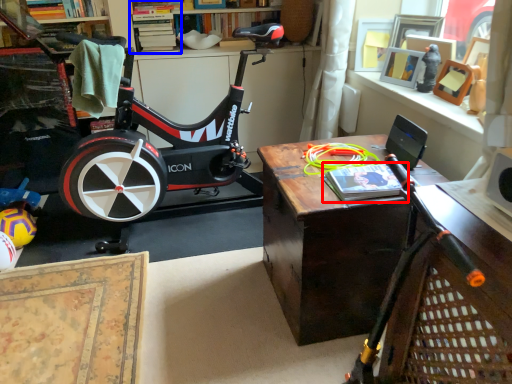
Question: Which object is closer to the camera taking this photo, book (highlighted by a red box) or shelf (highlighted by a blue box)?

Choices:
 (A) book
 (B) shelf

Answer: (A)